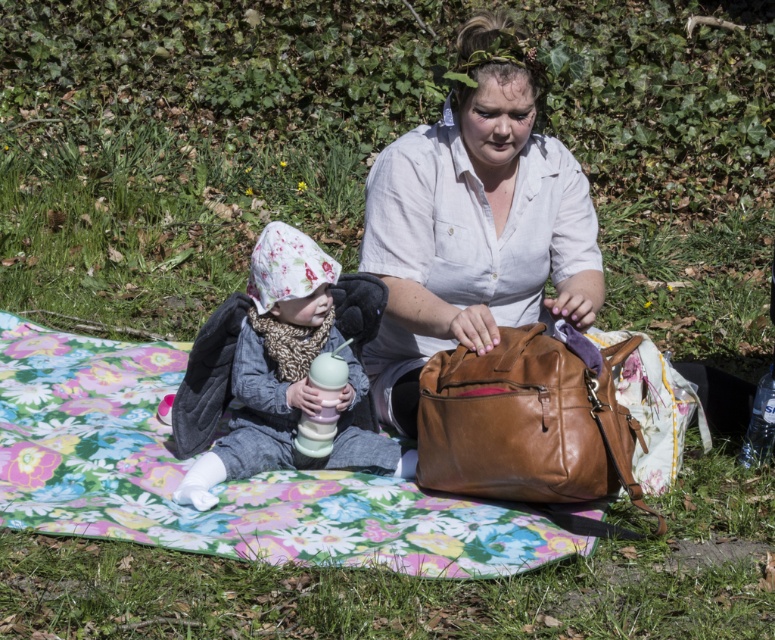
Question: Does floral fabric blanket at center appear over matte white shirt at center?

Choices:
 (A) yes
 (B) no

Answer: (B)

Question: Is fluffy fleece hat at center bigger than clear plastic bottle at lower right?

Choices:
 (A) yes
 (B) no

Answer: (A)

Question: Among these objects, which one is farthest from the camera?

Choices:
 (A) brown leather bag at center
 (B) matte white shirt at center
 (C) clear plastic bottle at lower right

Answer: (C)

Question: Which point appears farthest from the camera in this image?

Choices:
 (A) (522, 124)
 (B) (329, 476)

Answer: (B)

Question: Among these points, which one is nearest to the camera?

Choices:
 (A) [400, 417]
 (B) [188, 470]

Answer: (B)

Question: Is floral fabric blanket at center thinner than fluffy fleece hat at center?

Choices:
 (A) yes
 (B) no

Answer: (B)